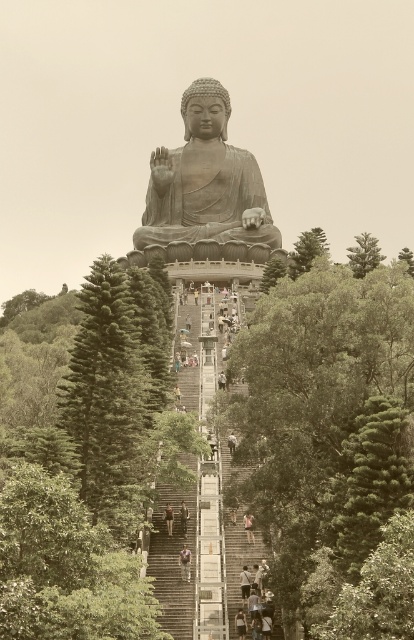
You are a photographer planning to capture a photo of the seated Buddha statue. You notice two items at the center of the scene that might distract the viewer. Which item is narrower between the camouflage pants at center and the dark brown leather shoes at center?

The camouflage pants at center is narrower than the dark brown leather shoes at center.